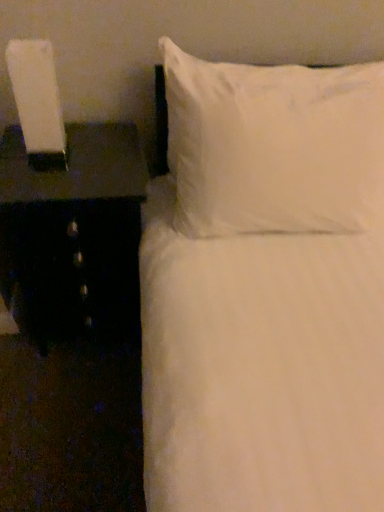
Identify the location of free space in front of white glossy lamp at left. (50, 184).